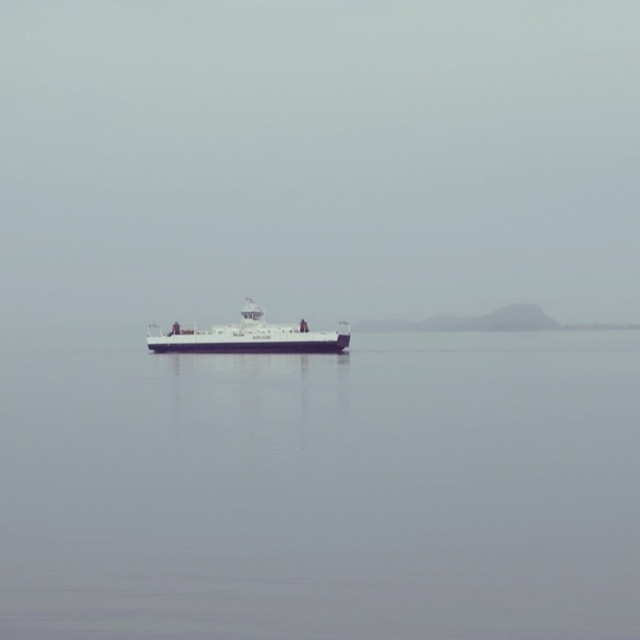
You are a sailor on the white matte ship at center. You want to check the water level below your ship. Which direction should you look to see the smooth gray water at center?

The smooth gray water at center is located below the white matte ship at center, so you should look downward to see the smooth gray water at center.